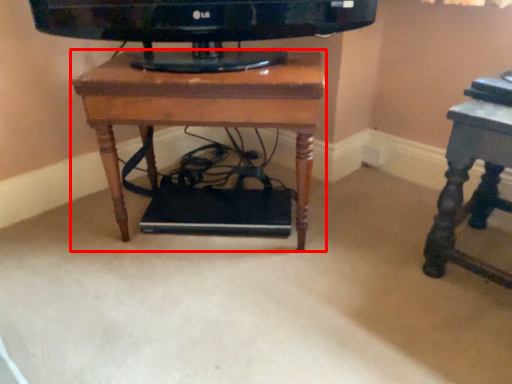
Question: From the image's perspective, where is table (annotated by the red box) located relative to table?

Choices:
 (A) above
 (B) below

Answer: (A)